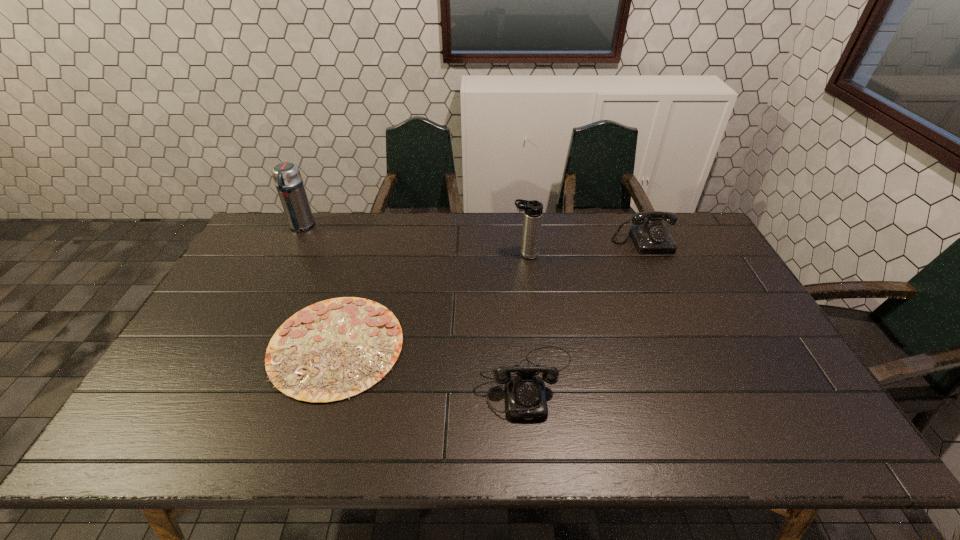
You are a GUI agent. You are given a task and a screenshot of the screen. Output one action in this format:
    pyautogui.click(x=<x>, y=<y>)
    Task: Click on the free space that is in between the shortest object and the leftmost object
    
    Given the screenshot: What is the action you would take?
    pyautogui.click(x=319, y=286)

Where is `empty location between the nearer thermos bottle and the left telephone`? The image size is (960, 540). empty location between the nearer thermos bottle and the left telephone is located at coordinates (526, 318).

Locate an element on the screen. This screenshot has width=960, height=540. vacant space that's between the leftmost object and the nearer telephone is located at coordinates (414, 304).

Image resolution: width=960 pixels, height=540 pixels. I want to click on free spot between the fourth object from right to left and the right thermos bottle, so click(431, 300).

What are the coordinates of `object that is the closest one to the left thermos bottle` in the screenshot? It's located at (334, 349).

Image resolution: width=960 pixels, height=540 pixels. In order to click on object that stands as the fourth closest to the shortest object in this screenshot , I will do `click(650, 236)`.

Image resolution: width=960 pixels, height=540 pixels. I want to click on blank space that satisfies the following two spatial constraints: 1. on the handle side of the right thermos bottle; 2. on the front side of the pizza, so click(x=537, y=346).

Identify the location of vacant space that satisfies the following two spatial constraints: 1. with a handle on the side of the pizza; 2. on the left side of the farther thermos bottle. Image resolution: width=960 pixels, height=540 pixels. (240, 346).

You are a GUI agent. You are given a task and a screenshot of the screen. Output one action in this format:
    pyautogui.click(x=<x>, y=<y>)
    Task: Click on the vacant space that satisfies the following two spatial constraints: 1. on the handle side of the nearer thermos bottle; 2. on the front-facing side of the left telephone
    The height and width of the screenshot is (540, 960).
    Given the screenshot: What is the action you would take?
    pyautogui.click(x=540, y=381)